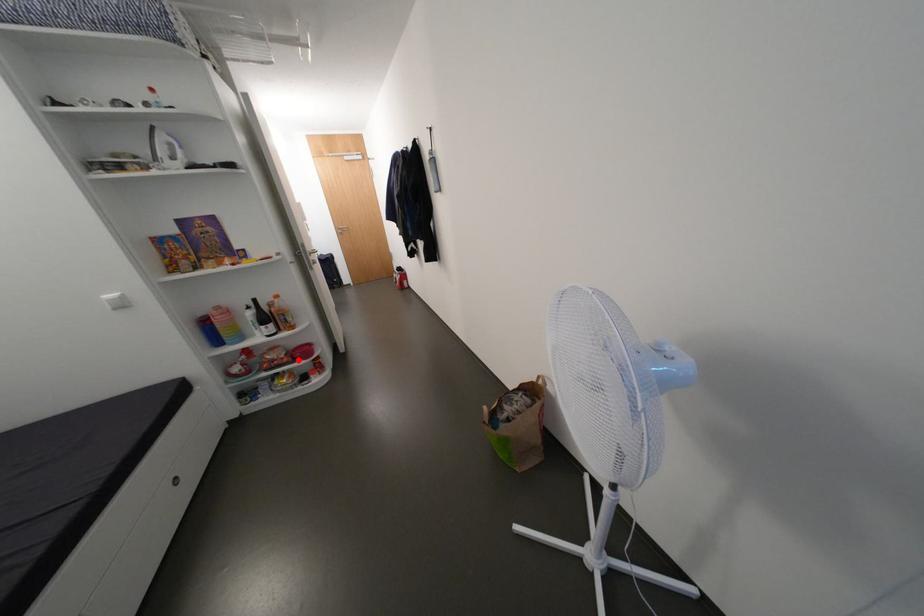
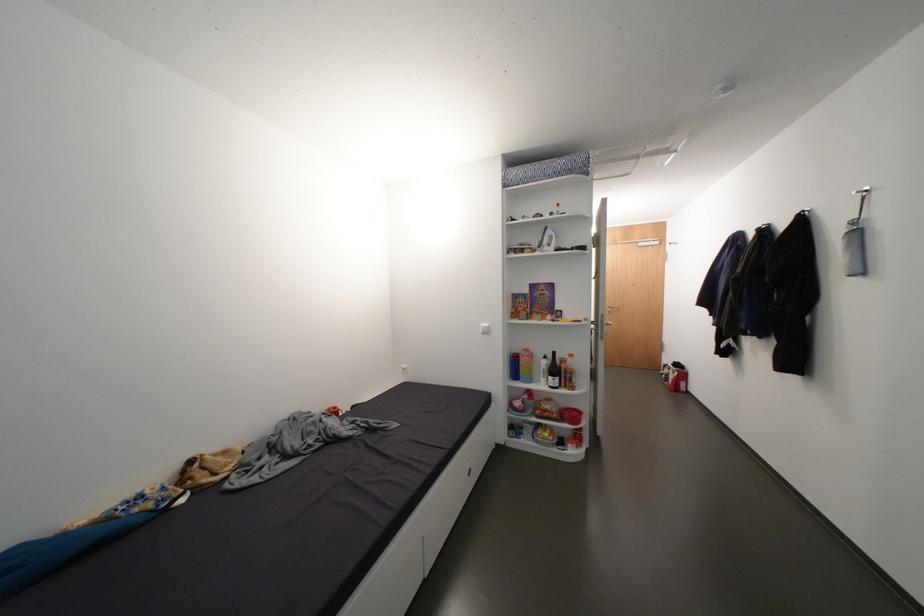
The point at the highlighted location is marked in the first image. Where is the corresponding point in the second image?

(566, 418)